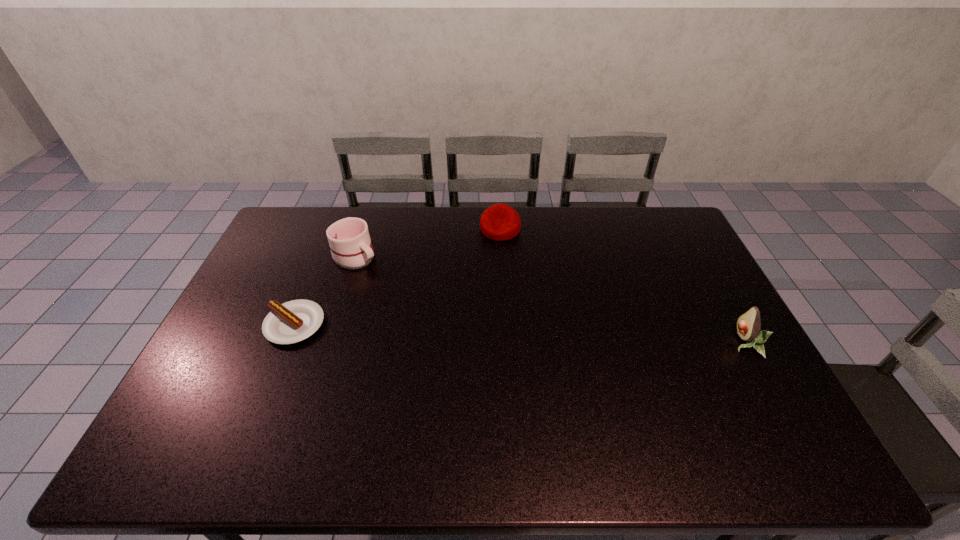
The image size is (960, 540). In the image, there is a desktop. In order to click on vacant space at the near edge in this screenshot , I will do `click(534, 422)`.

Image resolution: width=960 pixels, height=540 pixels. Find the location of `free space at the left edge`. free space at the left edge is located at coordinates (248, 364).

In the image, there is a desktop. Where is `free space at the right edge`? free space at the right edge is located at coordinates (712, 350).

Where is `free spot at the far left corner of the desktop`? The height and width of the screenshot is (540, 960). free spot at the far left corner of the desktop is located at coordinates (309, 215).

Locate an element on the screen. This screenshot has height=540, width=960. free spot between the rightmost object and the mug is located at coordinates (550, 300).

The height and width of the screenshot is (540, 960). I want to click on vacant point located between the rightmost object and the mug, so click(x=550, y=300).

Locate an element on the screen. free point between the shortest object and the rightmost object is located at coordinates point(520,334).

Image resolution: width=960 pixels, height=540 pixels. Identify the location of free spot between the shortest object and the mug. (325, 290).

Where is `vacant region between the mug and the second shortest object`? Image resolution: width=960 pixels, height=540 pixels. vacant region between the mug and the second shortest object is located at coordinates (428, 242).

Locate an element on the screen. The height and width of the screenshot is (540, 960). vacant space that is in between the beanbag and the rightmost object is located at coordinates (622, 286).